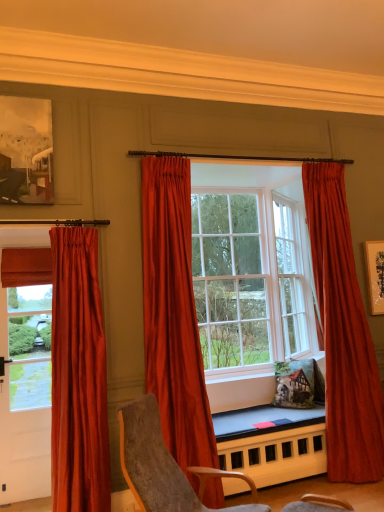
Consider the image. How much space does satin red curtain at left, marked as the first curtain in a left-to-right arrangement, occupy vertically?

satin red curtain at left, marked as the first curtain in a left-to-right arrangement, is 7.00 feet tall.

Measure the distance between point (295,267) and camera.

The distance of point (295,267) from camera is 4.70 meters.

This screenshot has height=512, width=384. Identify the location of satin orange curtain at center, placed as the 2th curtain when sorted from left to right. (173, 316).

Find the location of a particular element. This screenshot has width=384, height=512. satin red curtain at left, which is the third curtain in right-to-left order is located at coordinates tap(78, 376).

Considering the sizes of objects satin orange curtain at center, which ranks as the 2th curtain in right-to-left order, and satin red curtain at center, which appears as the 1th curtain when viewed from the right, in the image provided, who is wider, satin orange curtain at center, which ranks as the 2th curtain in right-to-left order, or satin red curtain at center, which appears as the 1th curtain when viewed from the right,?

With larger width is satin orange curtain at center, which ranks as the 2th curtain in right-to-left order.

Can you confirm if satin orange curtain at center, which ranks as the 2th curtain in right-to-left order, is bigger than satin red curtain at center, positioned as the third curtain in left-to-right order?

No.

Can satin red curtain at center, which appears as the 1th curtain when viewed from the right, be found inside satin orange curtain at center, placed as the 2th curtain when sorted from left to right?

No, satin red curtain at center, which appears as the 1th curtain when viewed from the right, is not surrounded by satin orange curtain at center, placed as the 2th curtain when sorted from left to right.

Is satin orange curtain at center, placed as the 2th curtain when sorted from left to right, not close to satin red curtain at center, which appears as the 1th curtain when viewed from the right?

Yes.

Is satin red curtain at center, which appears as the 1th curtain when viewed from the right, shorter than matte wooden picture frame at upper left?

No.

From a real-world perspective, which is physically below, satin red curtain at center, which appears as the 1th curtain when viewed from the right, or matte wooden picture frame at upper left?

satin red curtain at center, which appears as the 1th curtain when viewed from the right.

Considering the relative sizes of satin red curtain at center, which appears as the 1th curtain when viewed from the right, and matte wooden picture frame at upper left in the image provided, is satin red curtain at center, which appears as the 1th curtain when viewed from the right, bigger than matte wooden picture frame at upper left?

Indeed, satin red curtain at center, which appears as the 1th curtain when viewed from the right, has a larger size compared to matte wooden picture frame at upper left.

Is satin red curtain at center, which appears as the 1th curtain when viewed from the right, oriented away from matte wooden picture frame at upper left?

No, satin red curtain at center, which appears as the 1th curtain when viewed from the right, is not facing the opposite direction of matte wooden picture frame at upper left.

Which object is thinner, smooth wooden table at center or velvet gray chair at center?

With smaller width is smooth wooden table at center.

From the image's perspective, does smooth wooden table at center appear lower than velvet gray chair at center?

Correct, smooth wooden table at center appears lower than velvet gray chair at center in the image.

From the picture: Is smooth wooden table at center directly adjacent to velvet gray chair at center?

There is a gap between smooth wooden table at center and velvet gray chair at center.

Where is `table on the right of velvet gray chair at center`? Image resolution: width=384 pixels, height=512 pixels. table on the right of velvet gray chair at center is located at coordinates (272, 443).

Is matte wooden picture frame at upper left positioned with its back to satin red curtain at center, positioned as the third curtain in left-to-right order?

matte wooden picture frame at upper left is not turned away from satin red curtain at center, positioned as the third curtain in left-to-right order.

Between matte wooden picture frame at upper left and satin red curtain at center, which appears as the 1th curtain when viewed from the right, which one has less height?

matte wooden picture frame at upper left.

Which point is more forward, (7, 199) or (358, 307)?

The point (7, 199) is in front.

Would you say matte wooden picture frame at upper left is to the left or to the right of satin red curtain at center, positioned as the third curtain in left-to-right order, in the picture?

Clearly, matte wooden picture frame at upper left is on the left of satin red curtain at center, positioned as the third curtain in left-to-right order, in the image.

Is satin red curtain at left, which is the third curtain in right-to-left order, beside satin red curtain at center, which appears as the 1th curtain when viewed from the right?

No, satin red curtain at left, which is the third curtain in right-to-left order, is not next to satin red curtain at center, which appears as the 1th curtain when viewed from the right.

Based on the photo, which object is wider, satin red curtain at left, which is the third curtain in right-to-left order, or satin red curtain at center, which appears as the 1th curtain when viewed from the right?

satin red curtain at center, which appears as the 1th curtain when viewed from the right.

Does point (99, 400) come farther from viewer compared to point (328, 178)?

No, it is not.

Are matte wooden picture frame at upper left and satin red curtains at center making contact?

matte wooden picture frame at upper left and satin red curtains at center are not in contact.

From a real-world perspective, is matte wooden picture frame at upper left on satin red curtains at center?

Correct, in the physical world, matte wooden picture frame at upper left is higher than satin red curtains at center.

Who is more distant, matte wooden picture frame at upper left or satin red curtains at center?

satin red curtains at center is behind.

Based on their sizes in the image, would you say satin red curtain at center, which appears as the 1th curtain when viewed from the right, is bigger or smaller than velvet gray chair at center?

Considering their sizes, satin red curtain at center, which appears as the 1th curtain when viewed from the right, takes up more space than velvet gray chair at center.

Which of these two, satin red curtain at center, which appears as the 1th curtain when viewed from the right, or velvet gray chair at center, is wider?

velvet gray chair at center is wider.

In the image, is satin red curtain at center, positioned as the third curtain in left-to-right order, on the left side or the right side of velvet gray chair at center?

From the image, it's evident that satin red curtain at center, positioned as the third curtain in left-to-right order, is to the right of velvet gray chair at center.

From a real-world perspective, is satin red curtain at center, which appears as the 1th curtain when viewed from the right, on top of velvet gray chair at center?

Yes.

Where is `the 1st curtain below the satin orange curtain at center, which ranks as the 2th curtain in right-to-left order (from the image's perspective)`? the 1st curtain below the satin orange curtain at center, which ranks as the 2th curtain in right-to-left order (from the image's perspective) is located at coordinates (343, 333).

Where is `picture frame located above the satin red curtain at center, positioned as the third curtain in left-to-right order (from the image's perspective)`? This screenshot has height=512, width=384. picture frame located above the satin red curtain at center, positioned as the third curtain in left-to-right order (from the image's perspective) is located at coordinates (26, 151).

When comparing their distances from velvet gray chair at center, does satin red curtain at center, which appears as the 1th curtain when viewed from the right, or satin orange curtain at center, which ranks as the 2th curtain in right-to-left order, seem further?

The object further to velvet gray chair at center is satin red curtain at center, which appears as the 1th curtain when viewed from the right.

When comparing their distances from satin red curtain at center, positioned as the third curtain in left-to-right order, does smooth wooden table at center or satin red curtain at left, which is the third curtain in right-to-left order, seem further?

satin red curtain at left, which is the third curtain in right-to-left order.

Estimate the real-world distances between objects in this image. Which object is further from smooth wooden table at center, satin red curtain at center, which appears as the 1th curtain when viewed from the right, or satin red curtains at center?

Based on the image, satin red curtains at center appears to be further to smooth wooden table at center.

Based on their spatial positions, is satin orange curtain at center, placed as the 2th curtain when sorted from left to right, or smooth wooden table at center further from velvet gray chair at center?

The object further to velvet gray chair at center is smooth wooden table at center.

When comparing their distances from satin red curtain at center, positioned as the third curtain in left-to-right order, does satin red curtains at center or matte wooden picture frame at upper left seem closer?

satin red curtains at center lies closer to satin red curtain at center, positioned as the third curtain in left-to-right order, than the other object.

Which object lies further to the anchor point satin red curtain at center, positioned as the third curtain in left-to-right order, satin orange curtain at center, placed as the 2th curtain when sorted from left to right, or satin red curtain at left, which is the third curtain in right-to-left order?

satin red curtain at left, which is the third curtain in right-to-left order, lies further to satin red curtain at center, positioned as the third curtain in left-to-right order, than the other object.

From the image, which object appears to be farther from satin red curtain at left, marked as the first curtain in a left-to-right arrangement, satin red curtain at center, positioned as the third curtain in left-to-right order, or smooth wooden table at center?

The object further to satin red curtain at left, marked as the first curtain in a left-to-right arrangement, is satin red curtain at center, positioned as the third curtain in left-to-right order.

Looking at the image, which one is located closer to velvet gray chair at center, satin red curtain at center, which appears as the 1th curtain when viewed from the right, or matte wooden picture frame at upper left?

Among the two, satin red curtain at center, which appears as the 1th curtain when viewed from the right, is located nearer to velvet gray chair at center.

The width and height of the screenshot is (384, 512). I want to click on window that lies between matte wooden picture frame at upper left and velvet gray chair at center from top to bottom, so click(x=250, y=268).

Find the location of a particular element. The image size is (384, 512). window situated between satin red curtain at left, which is the third curtain in right-to-left order, and satin red curtain at center, which appears as the 1th curtain when viewed from the right, from left to right is located at coordinates (250, 268).

Locate an element on the screen. table between satin red curtain at left, which is the third curtain in right-to-left order, and satin red curtain at center, which appears as the 1th curtain when viewed from the right is located at coordinates (272, 443).

You are a GUI agent. You are given a task and a screenshot of the screen. Output one action in this format:
    pyautogui.click(x=<x>, y=<y>)
    Task: Click on the curtain between velvet gray chair at center and satin orange curtain at center, which ranks as the 2th curtain in right-to-left order, in the front-back direction
    This screenshot has width=384, height=512.
    Given the screenshot: What is the action you would take?
    pyautogui.click(x=78, y=376)